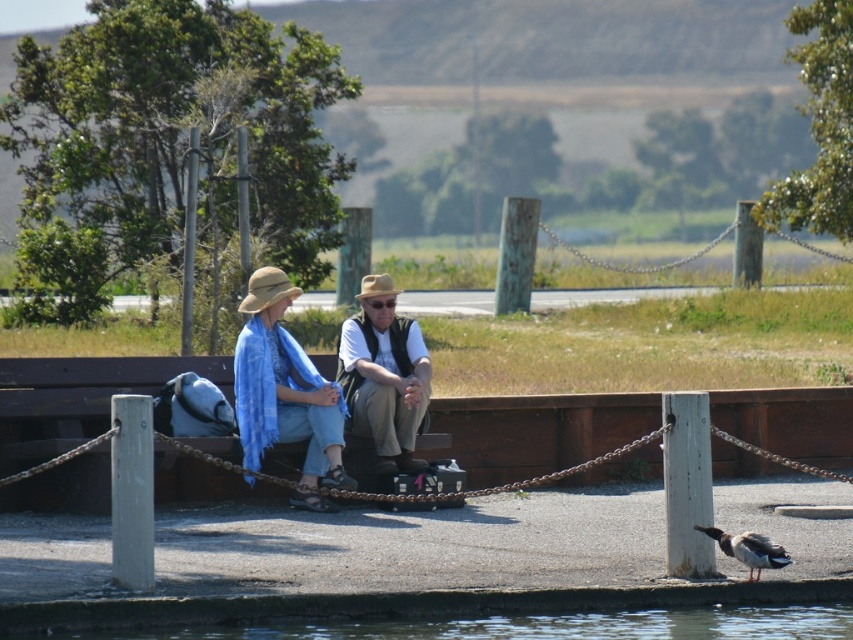
Question: Can you confirm if matte white shirt at center is smaller than beige straw hat at center?

Choices:
 (A) yes
 (B) no

Answer: (B)

Question: Does matte white shirt at center have a smaller size compared to matte brown hat at center?

Choices:
 (A) yes
 (B) no

Answer: (B)

Question: Does matte white shirt at center appear over brown woven cowboy hat at center?

Choices:
 (A) no
 (B) yes

Answer: (A)

Question: Which of the following is the closest to the observer?

Choices:
 (A) (466, 628)
 (B) (248, 282)
 (C) (370, 273)

Answer: (A)

Question: Which of these objects is positioned closest to the wooden park bench at center?

Choices:
 (A) matte brown hat at center
 (B) dark brown feathers at lower right
 (C) brown woven cowboy hat at center
 (D) beige straw hat at center

Answer: (D)

Question: Which object is positioned farthest from the beige straw hat at center?

Choices:
 (A) matte brown hat at center
 (B) clear water at lower center

Answer: (B)